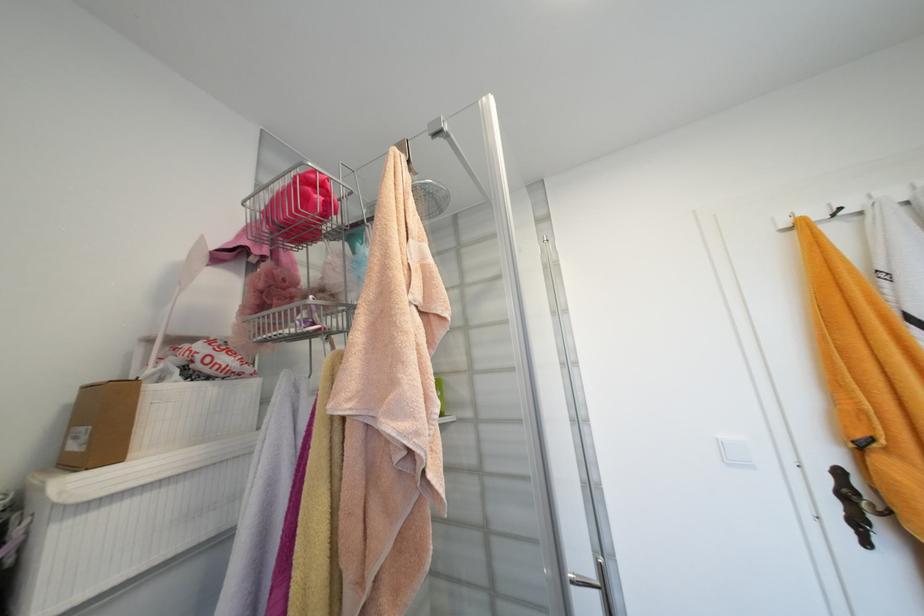
Find where to grip the white brush handle. Please return your answer as a coordinate pair (x, y).

(164, 323)